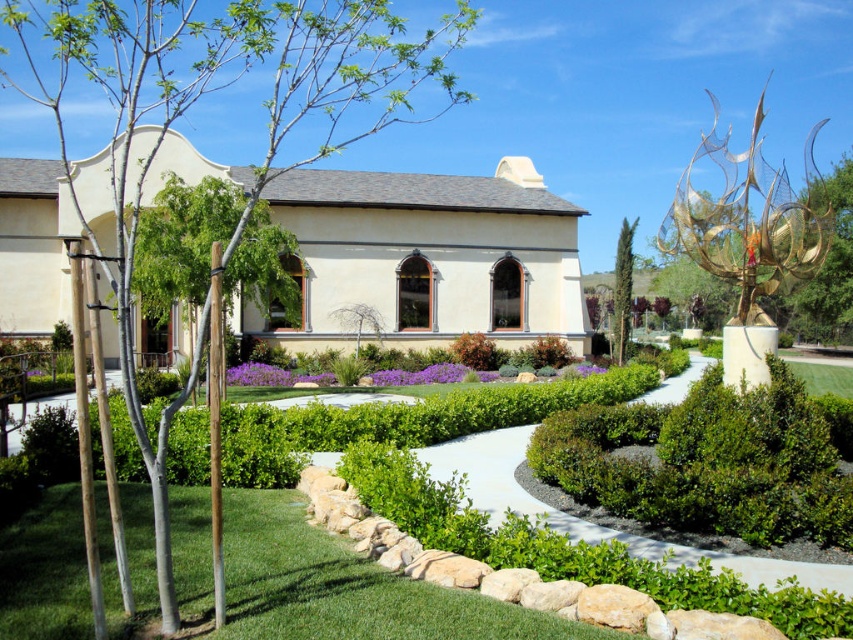
Does green grass at lower left lie behind green leafy hedge at center?

No, green grass at lower left is in front of green leafy hedge at center.

Can you confirm if green grass at lower left is wider than green leafy hedge at center?

Incorrect, green grass at lower left's width does not surpass green leafy hedge at center's.

Which is behind, point (9, 544) or point (824, 534)?

The point (824, 534) is more distant.

Identify the location of green grass at lower left. The image size is (853, 640). (347, 586).

Describe the element at coordinates (196, 99) in the screenshot. The width and height of the screenshot is (853, 640). I see `green leafy tree at left` at that location.

How far apart are green leafy tree at left and green leafy hedge at center?

28.91 meters

Which is in front, point (413, 48) or point (631, 481)?

Point (413, 48)

Image resolution: width=853 pixels, height=640 pixels. In order to click on green leafy tree at left in this screenshot , I will do `click(196, 99)`.

Which of these two, green grass at lower left or green textured cypress at center, stands taller?

With more height is green textured cypress at center.

Can you confirm if green grass at lower left is positioned below green textured cypress at center?

Correct, green grass at lower left is located below green textured cypress at center.

Is point (49, 563) less distant than point (614, 284)?

Yes, it is.

Find the location of a particular element. This screenshot has height=640, width=853. green grass at lower left is located at coordinates (347, 586).